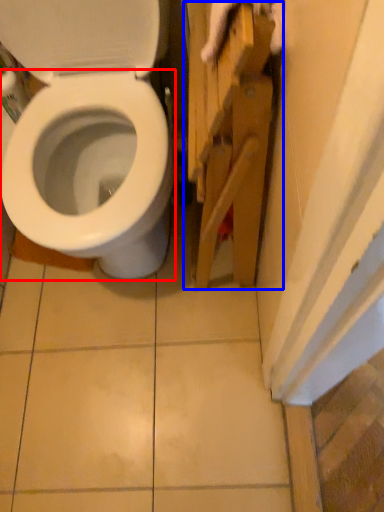
Question: Among these objects, which one is farthest to the camera, bidet (highlighted by a red box) or cabinetry (highlighted by a blue box)?

Choices:
 (A) bidet
 (B) cabinetry

Answer: (B)